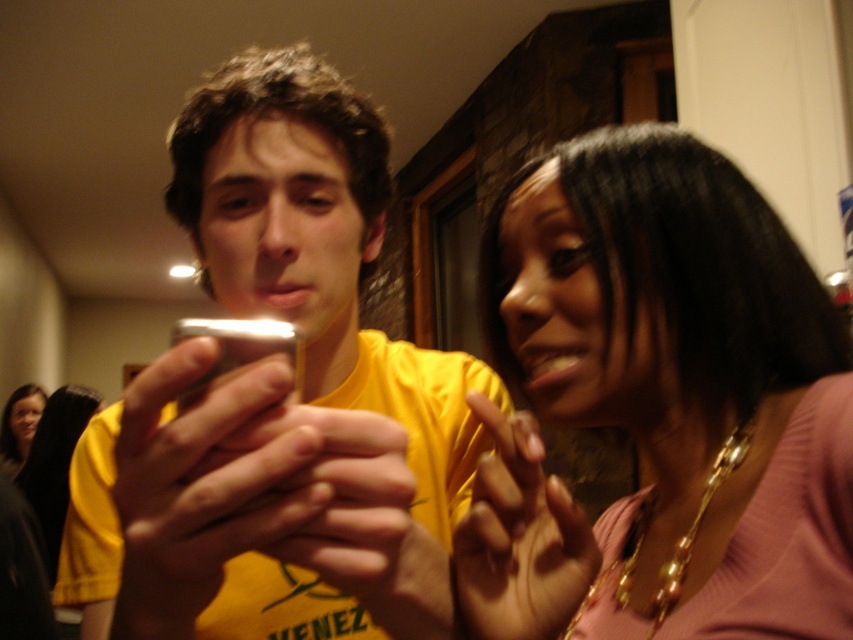
Question: Is matte pink sweater at center positioned before matte black hair at upper left?

Choices:
 (A) no
 (B) yes

Answer: (B)

Question: Among these points, which one is nearest to the camera?

Choices:
 (A) (556, 269)
 (B) (18, 400)
 (C) (221, 579)

Answer: (C)

Question: Which of the following is the farthest from the observer?

Choices:
 (A) matte pink sweater at center
 (B) matte yellow shirt at center

Answer: (A)

Question: Among these points, which one is farthest from the camera?

Choices:
 (A) (293, 278)
 (B) (20, 440)
 (C) (833, 419)

Answer: (B)

Question: Is matte pink sweater at center to the right of matte black hair at upper left from the viewer's perspective?

Choices:
 (A) no
 (B) yes

Answer: (B)

Question: Can you confirm if matte yellow shirt at center is positioned to the right of matte black hair at upper left?

Choices:
 (A) yes
 (B) no

Answer: (A)